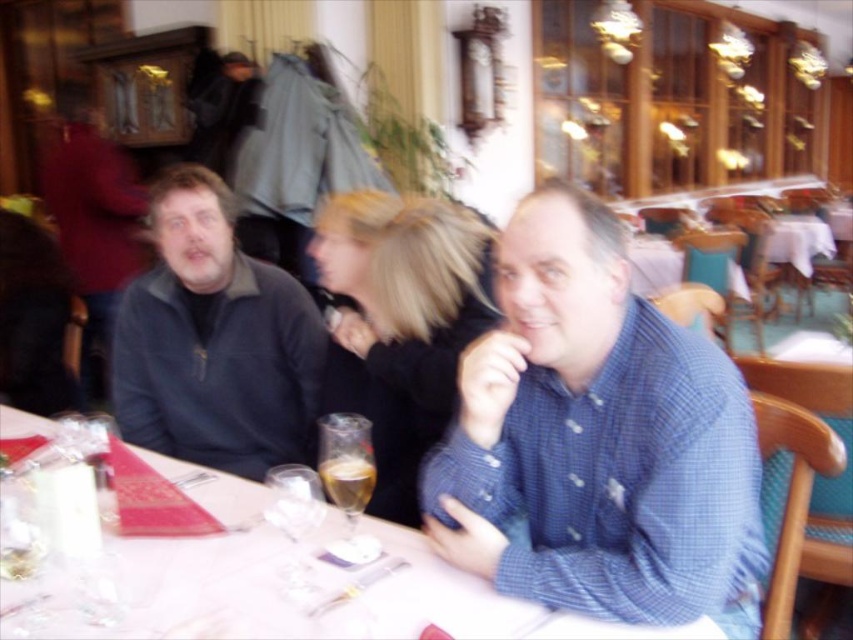
Question: Which point is farther to the camera?

Choices:
 (A) (360, 444)
 (B) (425, 416)
 (C) (155, 326)
 (D) (30, 413)

Answer: (D)

Question: Does white glossy table at center appear on the left side of clear glass wine at center?

Choices:
 (A) yes
 (B) no

Answer: (A)

Question: Can you confirm if white glossy table at center is positioned below blonde hair at center?

Choices:
 (A) yes
 (B) no

Answer: (A)

Question: Which of the following is the closest to the observer?

Choices:
 (A) clear glass wine glass at table center
 (B) dark blue fleece at left
 (C) blue checkered shirt at center
 (D) white glossy table at center

Answer: (C)

Question: Does blue checkered shirt at center have a smaller size compared to blonde hair at center?

Choices:
 (A) no
 (B) yes

Answer: (A)

Question: Which point appears closest to the camera in this image?

Choices:
 (A) (332, 497)
 (B) (445, 211)

Answer: (A)